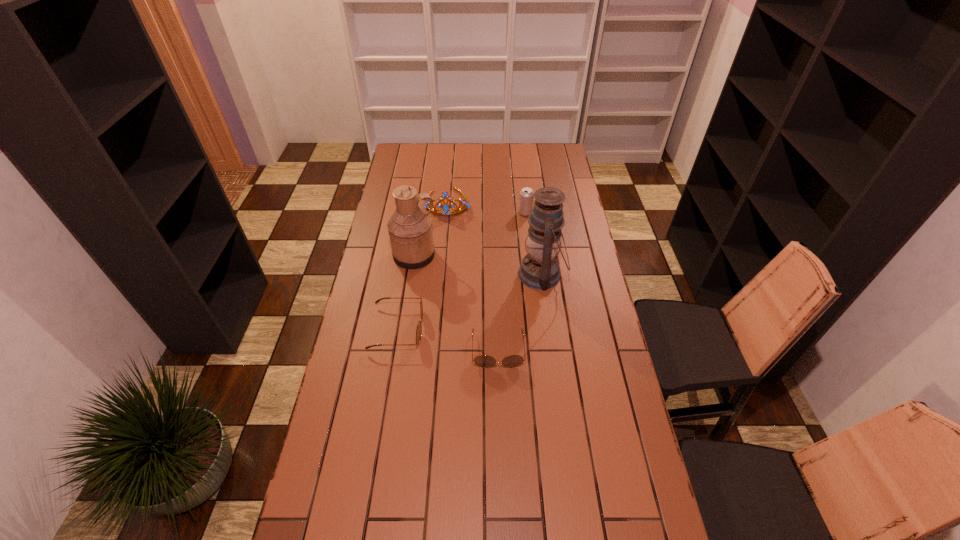
In the image, there is a desktop. What are the coordinates of `blank space at the right edge` in the screenshot? It's located at (584, 292).

Locate an element on the screen. blank space at the far left corner of the desktop is located at coordinates (411, 145).

At what (x,y) coordinates should I click in order to perform the action: click on vacant space at the far right corner of the desktop. Please return your answer as a coordinate pair (x, y). This screenshot has height=540, width=960. Looking at the image, I should click on (568, 165).

Find the location of a particular element. The width and height of the screenshot is (960, 540). free spot between the beer can and the tiara is located at coordinates (487, 207).

The height and width of the screenshot is (540, 960). What are the coordinates of `vacant area that lies between the beer can and the third object from right to left` in the screenshot? It's located at (512, 281).

At what (x,y) coordinates should I click in order to perform the action: click on free space between the beer can and the right sunglasses. Please return your answer as a coordinate pair (x, y). The width and height of the screenshot is (960, 540). Looking at the image, I should click on (512, 281).

Find the location of a particular element. This screenshot has height=540, width=960. free space between the shortest object and the oil lamp is located at coordinates (520, 312).

The height and width of the screenshot is (540, 960). What are the coordinates of `vacant area that lies between the taller sunglasses and the oil lamp` in the screenshot? It's located at (469, 301).

I want to click on vacant area that lies between the taller sunglasses and the pitcher, so click(x=406, y=292).

Find the location of `object that is the fifth closest to the oil lamp`. object that is the fifth closest to the oil lamp is located at coordinates (419, 328).